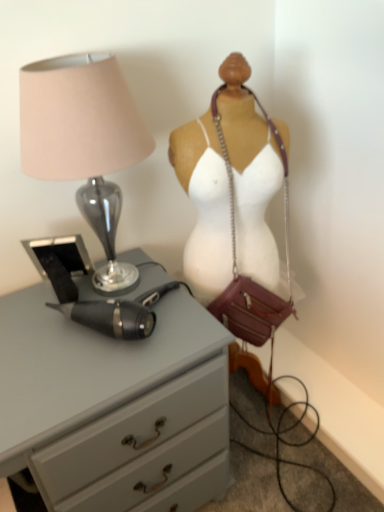
Where is `vacant space in front of matte glass lamp at left`? The height and width of the screenshot is (512, 384). vacant space in front of matte glass lamp at left is located at coordinates (81, 369).